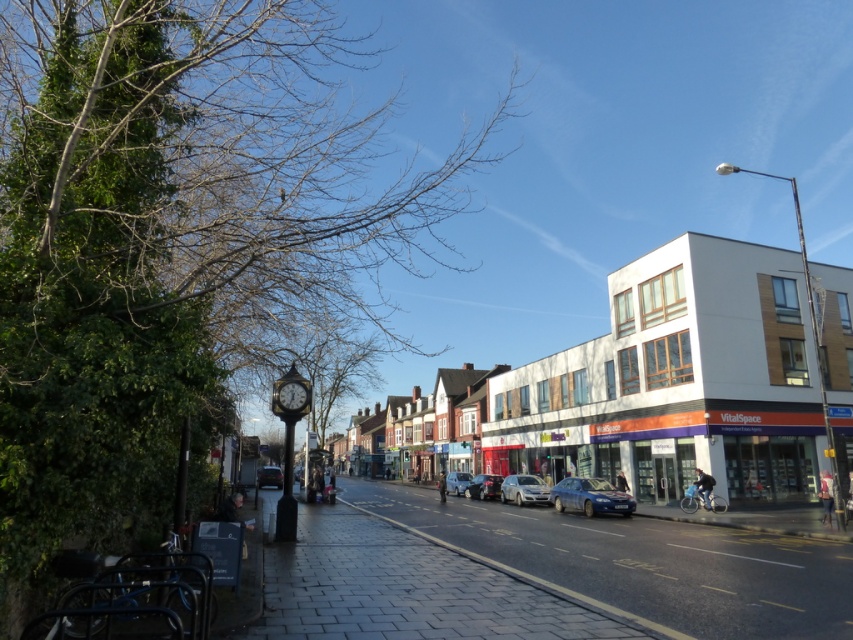
Looking at this image, between shiny metallic car at center and metallic clock at center-left, which one appears on the left side from the viewer's perspective?

metallic clock at center-left is more to the left.

Does shiny metallic car at center appear on the left side of metallic clock at center-left?

No, shiny metallic car at center is not to the left of metallic clock at center-left.

This screenshot has height=640, width=853. In order to click on shiny metallic car at center in this screenshot , I will do `click(485, 486)`.

Locate an element on the screen. This screenshot has width=853, height=640. shiny metallic car at center is located at coordinates (485, 486).

Is blue metallic car at center behind metallic silver car at center?

No, blue metallic car at center is closer to the viewer.

Is point (624, 504) farther from viewer compared to point (465, 476)?

No, (624, 504) is in front of (465, 476).

Locate an element on the screen. This screenshot has width=853, height=640. blue metallic car at center is located at coordinates (x=590, y=497).

Can you confirm if metallic silver car at center is smaller than dark gray metallic car at center?

No.

Which is more to the right, metallic silver car at center or dark gray metallic car at center?

Positioned to the right is metallic silver car at center.

Who is more forward, (459, 481) or (277, 486)?

Point (459, 481) is more forward.

In order to click on metallic silver car at center in this screenshot , I will do `click(457, 483)`.